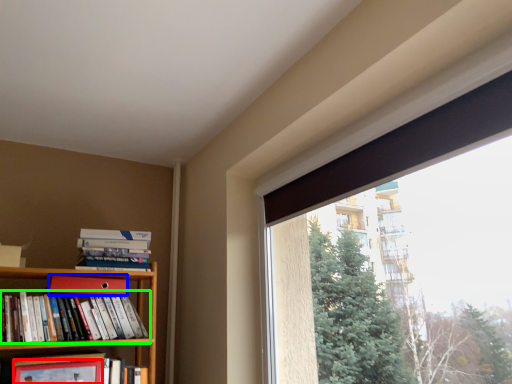
Question: Which object is positioned farthest from paperback book (highlighted by a red box)? Select from paperback book (highlighted by a blue box) and book (highlighted by a green box).

Choices:
 (A) paperback book
 (B) book

Answer: (A)